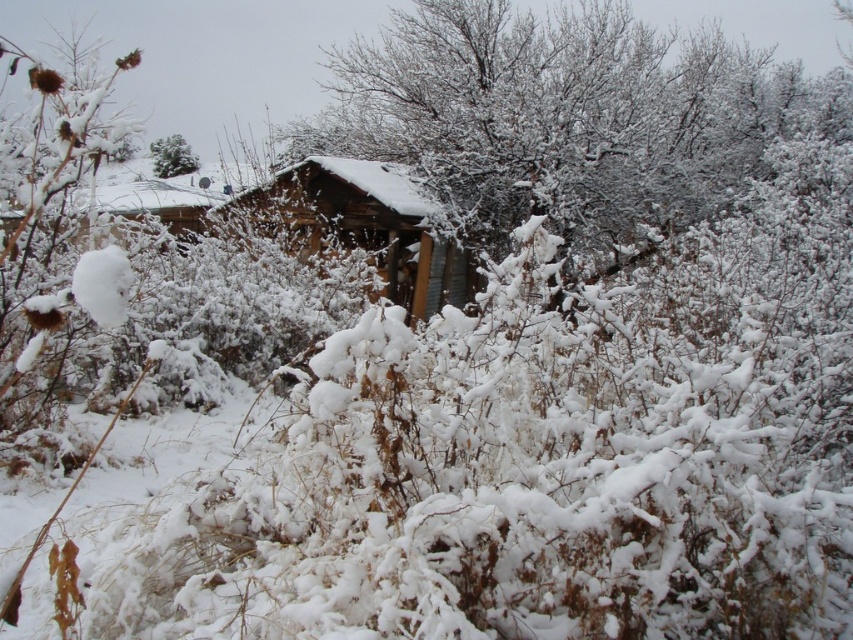
You are an explorer trying to reach the wooden cabin at center. There is a green matte tree at upper left blocking your path. Can you walk around the tree to get to the cabin?

The wooden cabin at center is larger in size than the green matte tree at upper left, but the tree is blocking your path. Since the tree is smaller than the cabin, you can walk around it to reach the cabin.